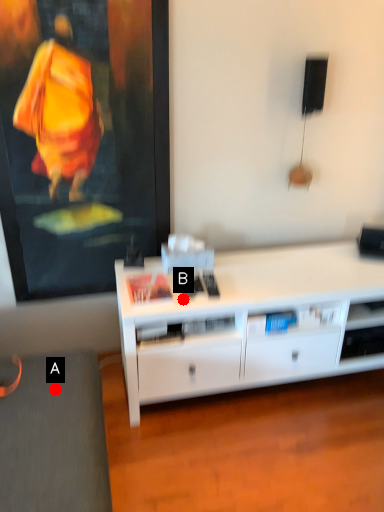
Question: Two points are circled on the image, labeled by A and B beside each circle. Which point is closer to the camera?

Choices:
 (A) A is closer
 (B) B is closer

Answer: (A)